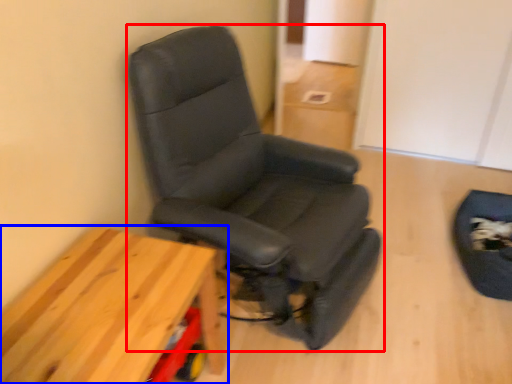
Question: Which of the following is the closest to the observer, chair (highlighted by a red box) or table (highlighted by a blue box)?

Choices:
 (A) chair
 (B) table

Answer: (B)